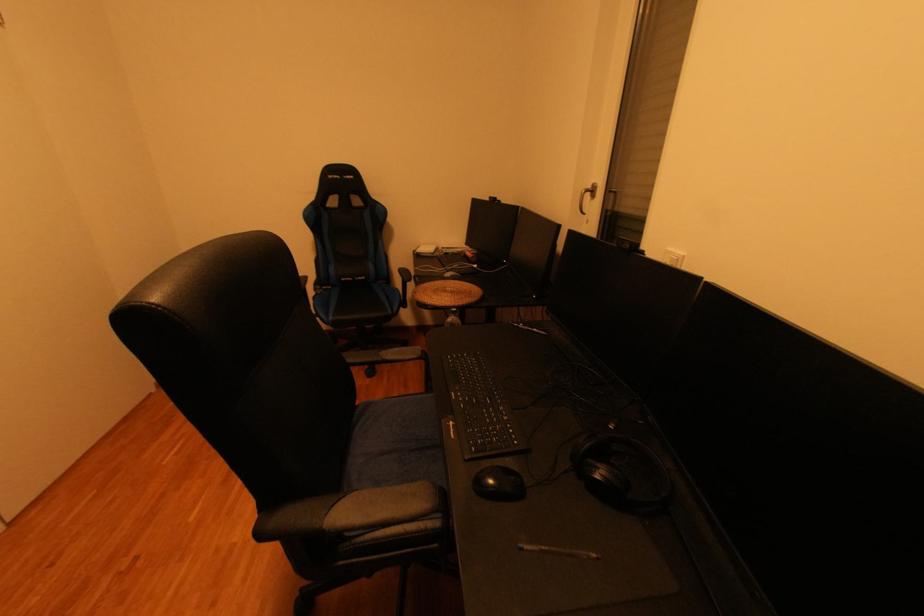
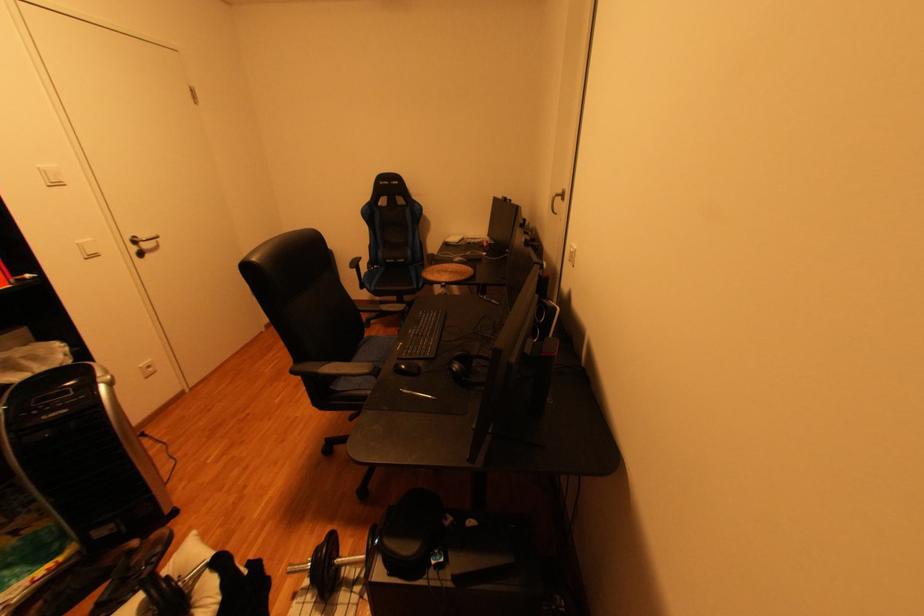
Where in the second image is the point corresponding to pixel 339 288 from the first image?

(390, 267)